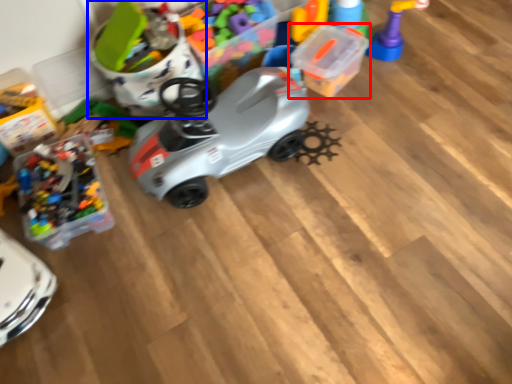
Question: Which of the following is the closest to the observer, toy (highlighted by a red box) or toy (highlighted by a blue box)?

Choices:
 (A) toy
 (B) toy

Answer: (B)